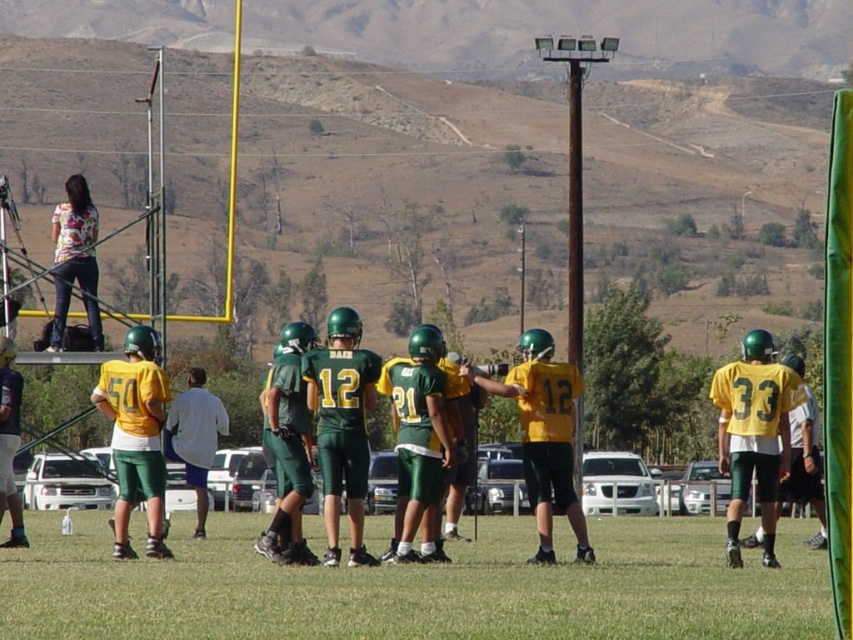
Question: Which object appears closest to the camera in this image?

Choices:
 (A) green grass at lower center
 (B) white fabric shirt at center

Answer: (A)

Question: Which point is closer to the camera?

Choices:
 (A) green grass at lower center
 (B) white fabric shirt at center

Answer: (A)

Question: Can you confirm if green grass at lower center is positioned to the right of white fabric shirt at center?

Choices:
 (A) yes
 (B) no

Answer: (A)

Question: Does green grass at lower center have a smaller size compared to white fabric shirt at center?

Choices:
 (A) no
 (B) yes

Answer: (A)

Question: Is green grass at lower center thinner than white fabric shirt at center?

Choices:
 (A) yes
 (B) no

Answer: (B)

Question: Which object appears farthest from the camera in this image?

Choices:
 (A) white fabric shirt at center
 (B) green grass at lower center

Answer: (A)